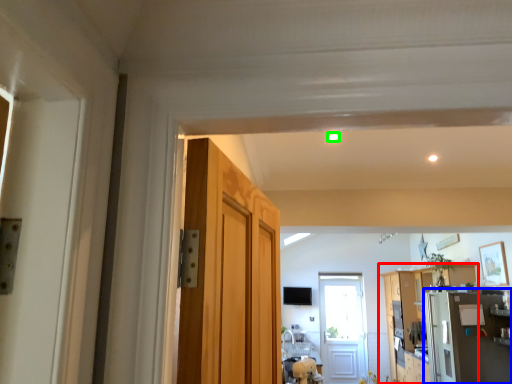
Question: Estimate the real-world distances between objects in this image. Which object is farther from cabinetry (highlighted by a red box), appliance (highlighted by a blue box) or light (highlighted by a green box)?

Choices:
 (A) appliance
 (B) light

Answer: (B)